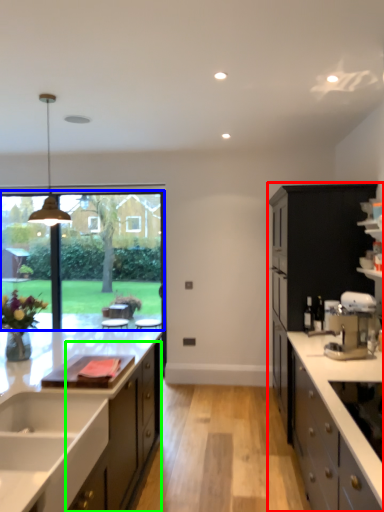
Question: Estimate the real-world distances between objects in this image. Which object is closer to cabinetry (highlighted by a red box), window screen (highlighted by a blue box) or cabinetry (highlighted by a green box)?

Choices:
 (A) window screen
 (B) cabinetry

Answer: (B)